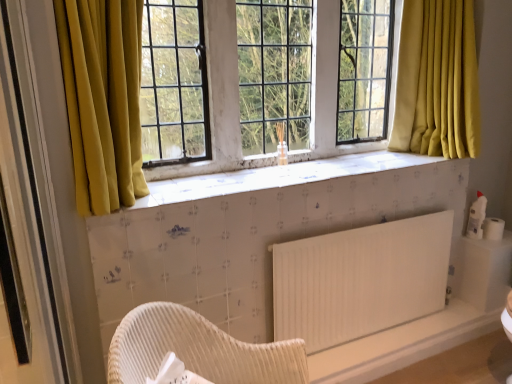
Locate an element on the screen. The height and width of the screenshot is (384, 512). vacant area on top of white textured tile at center (from a real-world perspective) is located at coordinates (283, 170).